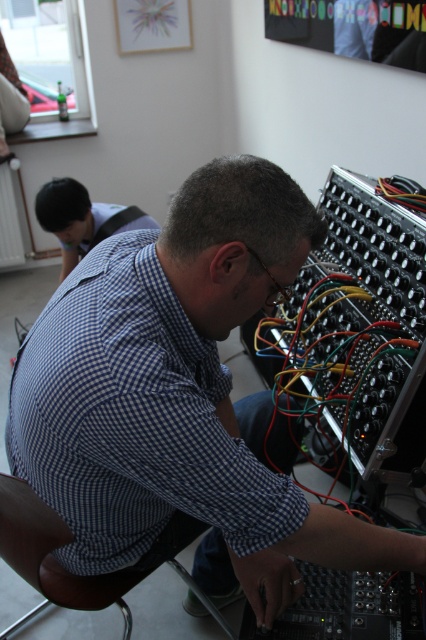
Question: Does blue checkered shirt at center appear over brown leather chair at lower left?

Choices:
 (A) no
 (B) yes

Answer: (B)

Question: Which object is positioned farthest from the blue checkered shirt at center?

Choices:
 (A) blue checkered shirt at upper left
 (B) brown leather chair at lower left

Answer: (A)

Question: In this image, where is blue checkered shirt at center located relative to blue checkered shirt at upper left?

Choices:
 (A) left
 (B) right

Answer: (B)

Question: Which of these objects is positioned farthest from the blue checkered shirt at center?

Choices:
 (A) brown leather chair at lower left
 (B) blue checkered shirt at upper left

Answer: (B)

Question: Among these points, which one is nearest to the camera?

Choices:
 (A) (48, 560)
 (B) (262, 481)
 (C) (49, 182)

Answer: (B)

Question: Is brown leather chair at lower left thinner than blue checkered shirt at upper left?

Choices:
 (A) no
 (B) yes

Answer: (B)